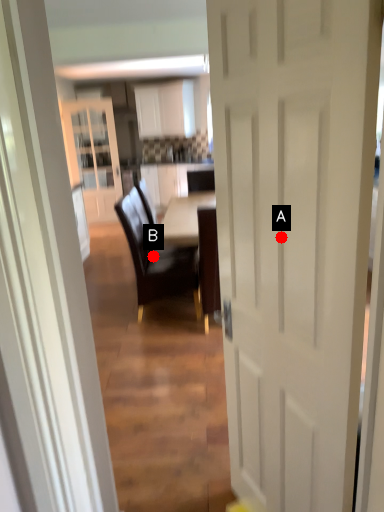
Question: Two points are circled on the image, labeled by A and B beside each circle. Which point is further to the camera?

Choices:
 (A) A is further
 (B) B is further

Answer: (B)